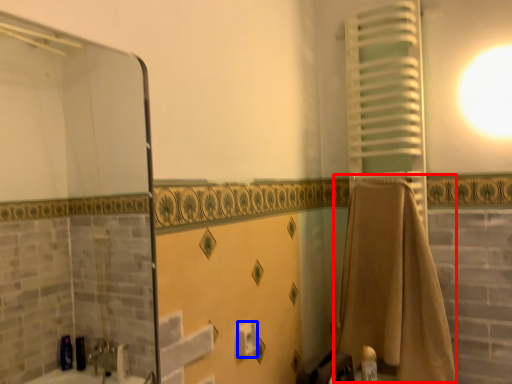
Question: Which object appears closest to the camera in this image, bath towel (highlighted by a red box) or toilet paper (highlighted by a blue box)?

Choices:
 (A) bath towel
 (B) toilet paper

Answer: (B)